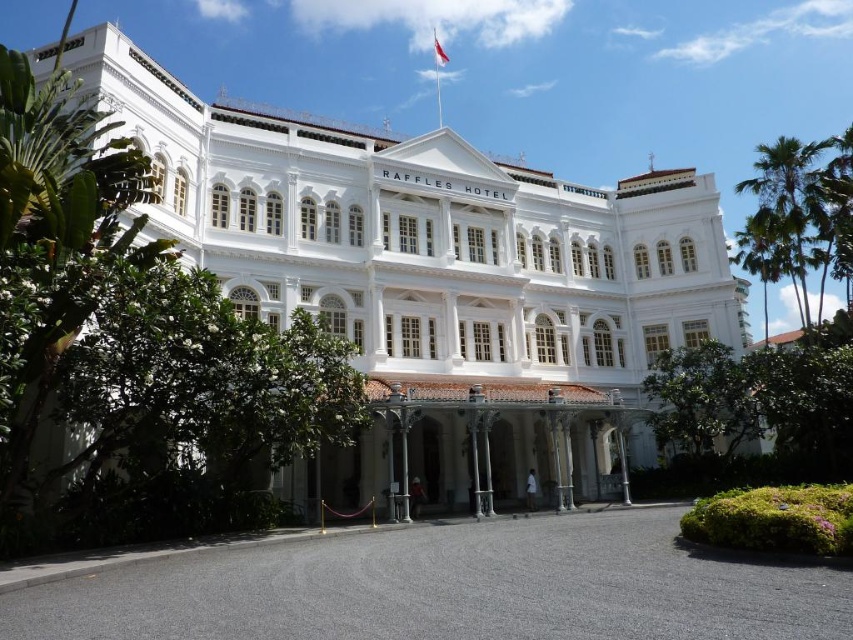
Question: Does white stone building at center have a larger size compared to green leafy palm tree at upper right?

Choices:
 (A) no
 (B) yes

Answer: (B)

Question: Which of the following is the farthest from the observer?

Choices:
 (A) white stone building at center
 (B) green leafy palm tree at upper right

Answer: (B)

Question: Can you confirm if white stone building at center is bigger than green leafy palm tree at upper right?

Choices:
 (A) no
 (B) yes

Answer: (B)

Question: Considering the relative positions of white stone building at center and green leafy palm tree at upper right in the image provided, where is white stone building at center located with respect to green leafy palm tree at upper right?

Choices:
 (A) left
 (B) right

Answer: (A)

Question: Which of the following is the farthest from the observer?

Choices:
 (A) (834, 221)
 (B) (364, 300)

Answer: (A)